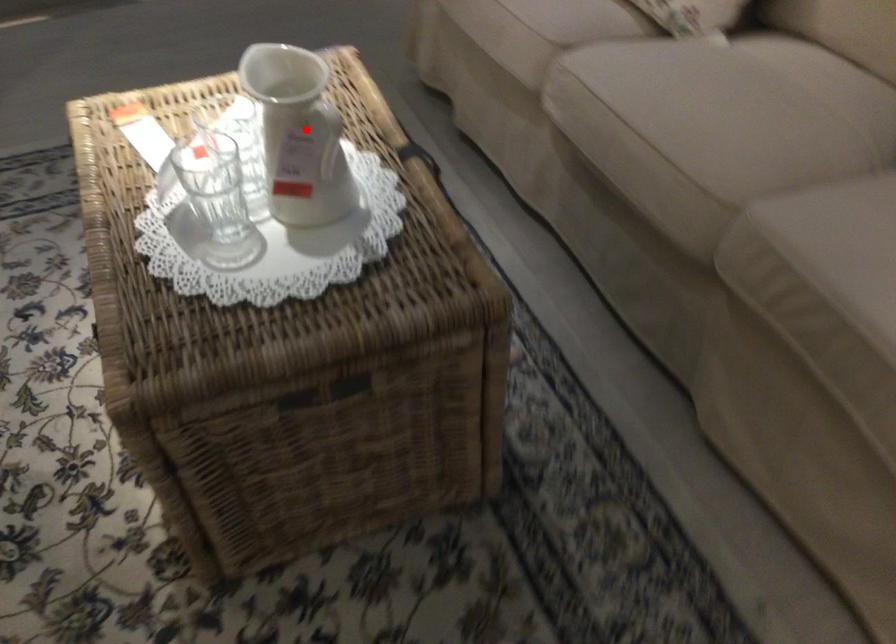
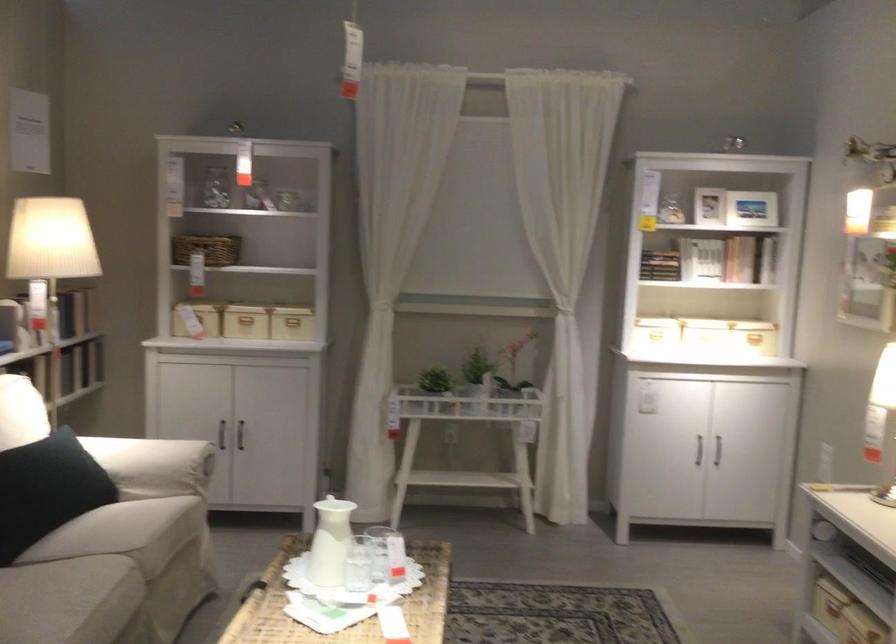
Question: I am providing you with two images of the same scene from different viewpoints. Given a red point in image1, look at the same physical point in image2. Is it:

Choices:
 (A) Closer to the viewpoint
 (B) Farther from the viewpoint

Answer: (B)